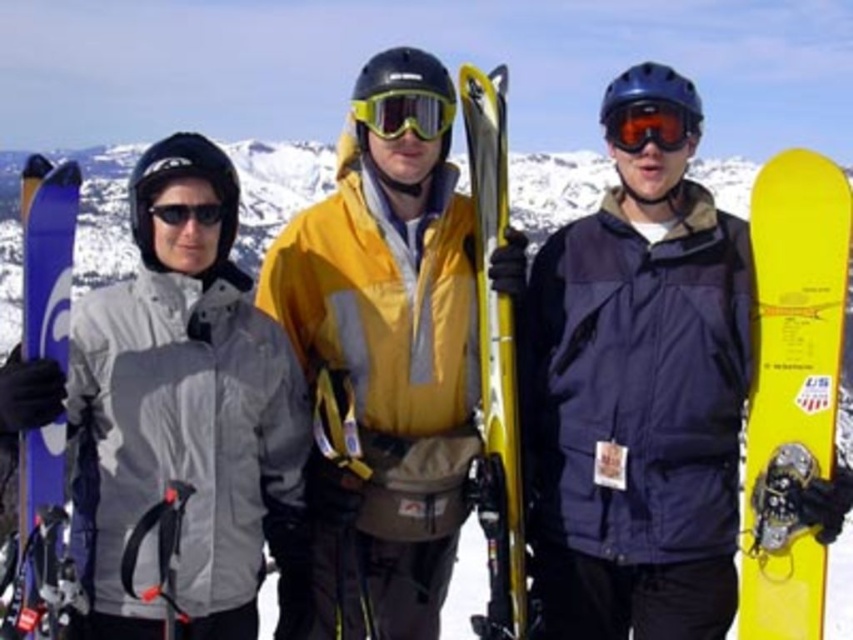
Question: Considering the real-world distances, which object is closest to the yellow metallic ski at center?

Choices:
 (A) orange reflective goggles at center
 (B) transparent reflective goggles at center
 (C) blue matte ski at left

Answer: (B)

Question: Is yellow matte ski at center below matte gray jacket at left?

Choices:
 (A) no
 (B) yes

Answer: (B)

Question: Which object appears farthest from the camera in this image?

Choices:
 (A) yellow matte snowboard at right
 (B) blue matte ski at left

Answer: (A)

Question: Is yellow matte ski at center behind yellow metallic ski at center?

Choices:
 (A) no
 (B) yes

Answer: (B)

Question: Which object is positioned farthest from the yellow metallic ski at center?

Choices:
 (A) transparent reflective goggles at center
 (B) matte gray jacket at left
 (C) orange reflective goggles at center

Answer: (B)

Question: Is matte gray jacket at left thinner than orange reflective goggles at center?

Choices:
 (A) no
 (B) yes

Answer: (A)